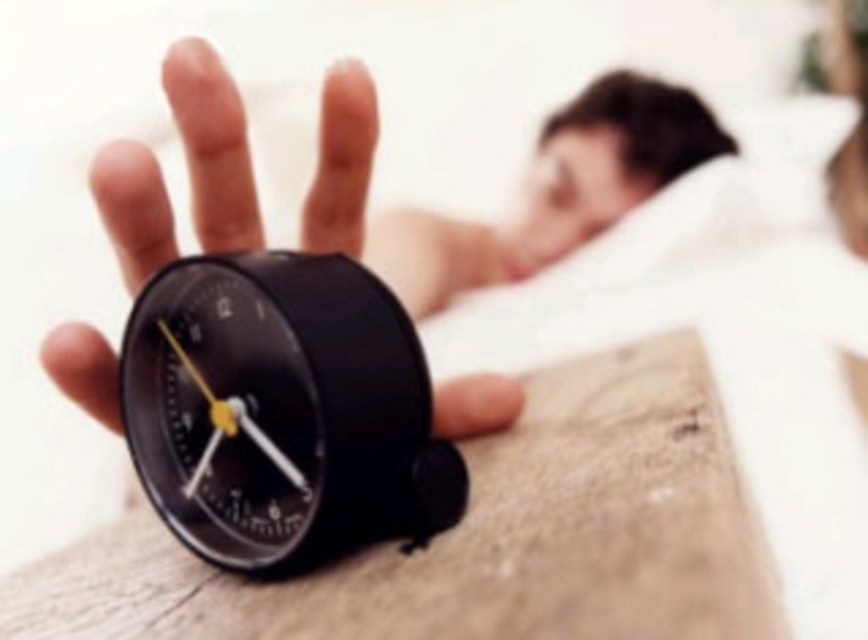
Question: Which object is farther from the camera taking this photo?

Choices:
 (A) matte black alarm clock at center
 (B) black plastic alarm clock at center

Answer: (A)

Question: Which point is closer to the camera?

Choices:
 (A) matte black alarm clock at center
 (B) black plastic alarm clock at center

Answer: (B)

Question: Observing the image, what is the correct spatial positioning of black plastic alarm clock at center in reference to matte black alarm clock at center?

Choices:
 (A) below
 (B) above

Answer: (A)

Question: Is black plastic alarm clock at center to the left of matte black alarm clock at center from the viewer's perspective?

Choices:
 (A) yes
 (B) no

Answer: (A)

Question: Which point appears closest to the camera in this image?

Choices:
 (A) (635, 184)
 (B) (169, 458)

Answer: (B)

Question: Can you confirm if black plastic alarm clock at center is positioned above matte black alarm clock at center?

Choices:
 (A) yes
 (B) no

Answer: (B)